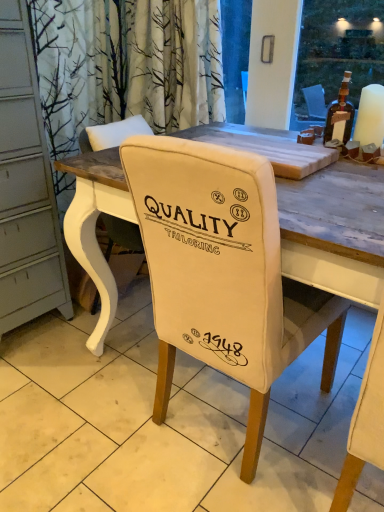
The height and width of the screenshot is (512, 384). I want to click on vacant space underneath white fabric chair at center (from a real-world perspective), so click(225, 418).